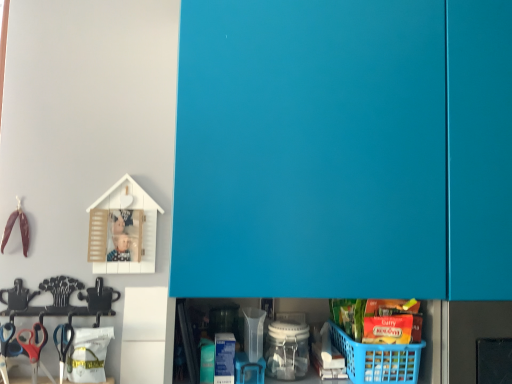
The width and height of the screenshot is (512, 384). Describe the element at coordinates (378, 359) in the screenshot. I see `blue plastic basket at lower right` at that location.

What do you see at coordinates (33, 345) in the screenshot? I see `pink plastic scissors at lower left` at bounding box center [33, 345].

Measure the distance between teal matte cabinet doors at upper center and camera.

They are 85.79 centimeters apart.

This screenshot has width=512, height=384. In order to click on blue plastic basket at lower right in this screenshot , I will do `click(378, 359)`.

Is teal matte cabinet doors at upper center not within blue plastic basket at lower right?

teal matte cabinet doors at upper center lies outside blue plastic basket at lower right's area.

Is blue plastic basket at lower right at the back of teal matte cabinet doors at upper center?

Yes, teal matte cabinet doors at upper center is positioned with its back facing blue plastic basket at lower right.

Looking at this image, which object is closer to the camera, teal matte cabinet doors at upper center or blue plastic basket at lower right?

Positioned in front is teal matte cabinet doors at upper center.

Measure the distance from teal matte cabinet doors at upper center to blue plastic basket at lower right.

teal matte cabinet doors at upper center is 41.65 centimeters from blue plastic basket at lower right.

From the image's perspective, is pink plastic scissors at lower left below teal matte cabinet doors at upper center?

Indeed, from the image's perspective, pink plastic scissors at lower left is shown beneath teal matte cabinet doors at upper center.

Is teal matte cabinet doors at upper center surrounded by pink plastic scissors at lower left?

No.

Find the location of a particular element. The width and height of the screenshot is (512, 384). scissors beneath the teal matte cabinet doors at upper center (from a real-world perspective) is located at coordinates (33, 345).

Is pink plastic scissors at lower left wider or thinner than teal matte cabinet doors at upper center?

Clearly, pink plastic scissors at lower left has less width compared to teal matte cabinet doors at upper center.

Which of these two, pink plastic scissors at lower left or blue plastic basket at lower right, stands shorter?

blue plastic basket at lower right.

Which object is further away from the camera taking this photo, pink plastic scissors at lower left or blue plastic basket at lower right?

pink plastic scissors at lower left is more distant.

Between pink plastic scissors at lower left and blue plastic basket at lower right, which one has smaller width?

With smaller width is pink plastic scissors at lower left.

From a real-world perspective, is blue plastic basket at lower right positioned over pink plastic scissors at lower left based on gravity?

Yes, from a real-world perspective, blue plastic basket at lower right is above pink plastic scissors at lower left.

From the image's perspective, which is above, blue plastic basket at lower right or pink plastic scissors at lower left?

blue plastic basket at lower right, from the image's perspective.

Considering the relative positions of blue plastic basket at lower right and pink plastic scissors at lower left in the image provided, is blue plastic basket at lower right behind pink plastic scissors at lower left?

No.

From the picture: Can you confirm if blue plastic basket at lower right is smaller than pink plastic scissors at lower left?

Actually, blue plastic basket at lower right might be larger than pink plastic scissors at lower left.

Does point (331, 338) lie in front of point (394, 279)?

No, it is behind (394, 279).

Is blue plastic basket at lower right next to teal matte cabinet doors at upper center?

blue plastic basket at lower right is not next to teal matte cabinet doors at upper center, and they're not touching.

Would you say blue plastic basket at lower right is outside teal matte cabinet doors at upper center?

No, blue plastic basket at lower right is not outside of teal matte cabinet doors at upper center.

Based on the photo, can you confirm if blue plastic basket at lower right is shorter than teal matte cabinet doors at upper center?

Indeed, blue plastic basket at lower right has a lesser height compared to teal matte cabinet doors at upper center.

Which is nearer, (422,51) or (38,361)?

The point (422,51) is in front.

Which is behind, teal matte cabinet doors at upper center or pink plastic scissors at lower left?

pink plastic scissors at lower left is further from the camera.

From the image's perspective, between teal matte cabinet doors at upper center and pink plastic scissors at lower left, who is located below?

From the image's view, pink plastic scissors at lower left is below.

Find the location of `basket that appears behind the teal matte cabinet doors at upper center`. basket that appears behind the teal matte cabinet doors at upper center is located at coordinates (378, 359).

At what (x,y) coordinates should I click in order to perform the action: click on scissors below the teal matte cabinet doors at upper center (from the image's perspective). Please return your answer as a coordinate pair (x, y). Looking at the image, I should click on (33, 345).

Which object lies nearer to the anchor point teal matte cabinet doors at upper center, blue plastic basket at lower right or pink plastic scissors at lower left?

Based on the image, blue plastic basket at lower right appears to be nearer to teal matte cabinet doors at upper center.

Estimate the real-world distances between objects in this image. Which object is closer to blue plastic basket at lower right, teal matte cabinet doors at upper center or pink plastic scissors at lower left?

teal matte cabinet doors at upper center is positioned closer to the anchor blue plastic basket at lower right.

When comparing their distances from teal matte cabinet doors at upper center, does pink plastic scissors at lower left or blue plastic basket at lower right seem closer?

The object closer to teal matte cabinet doors at upper center is blue plastic basket at lower right.

Considering their positions, is blue plastic basket at lower right positioned further to pink plastic scissors at lower left than teal matte cabinet doors at upper center?

Among the two, teal matte cabinet doors at upper center is located further to pink plastic scissors at lower left.

When comparing their distances from blue plastic basket at lower right, does pink plastic scissors at lower left or teal matte cabinet doors at upper center seem further?

pink plastic scissors at lower left is positioned further to the anchor blue plastic basket at lower right.

From the image, which object appears to be farther from pink plastic scissors at lower left, teal matte cabinet doors at upper center or blue plastic basket at lower right?

teal matte cabinet doors at upper center.

Image resolution: width=512 pixels, height=384 pixels. Find the location of `basket situated between pink plastic scissors at lower left and teal matte cabinet doors at upper center from left to right`. basket situated between pink plastic scissors at lower left and teal matte cabinet doors at upper center from left to right is located at coordinates (378, 359).